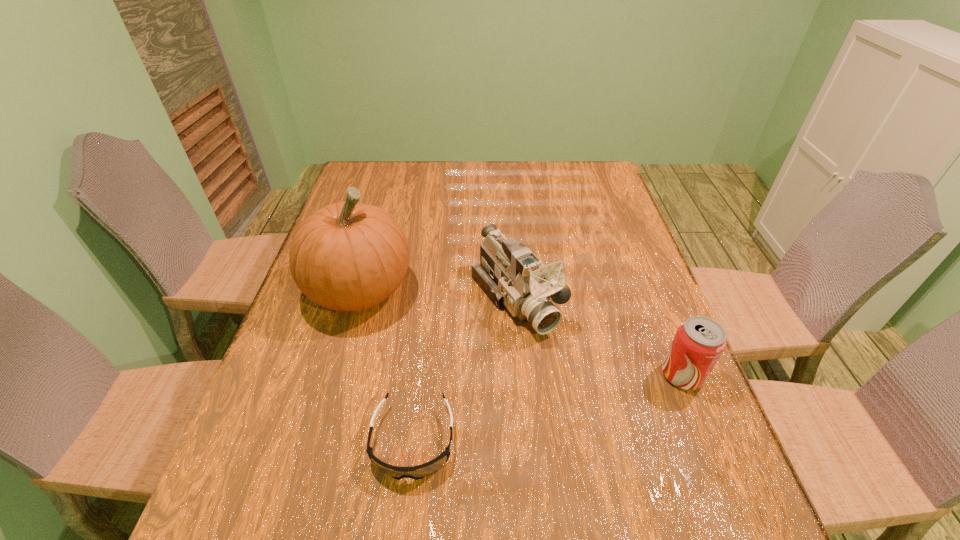
Where is `free region located 0.230m on the front-facing side of the third object from left to right`? This screenshot has width=960, height=540. free region located 0.230m on the front-facing side of the third object from left to right is located at coordinates (606, 418).

Locate an element on the screen. Image resolution: width=960 pixels, height=540 pixels. blank space located 0.120m on the stem of the tallest object is located at coordinates (443, 328).

Image resolution: width=960 pixels, height=540 pixels. Find the location of `vacant space located on the stem of the tallest object`. vacant space located on the stem of the tallest object is located at coordinates (486, 348).

Identify the location of free space located on the stem of the tallest object. (490, 350).

You are a GUI agent. You are given a task and a screenshot of the screen. Output one action in this format:
    pyautogui.click(x=<x>, y=<y>)
    Task: Click on the object positioned at the near edge
    This screenshot has width=960, height=540.
    Given the screenshot: What is the action you would take?
    pyautogui.click(x=421, y=471)

Image resolution: width=960 pixels, height=540 pixels. I want to click on object present at the left edge, so click(x=347, y=256).

This screenshot has width=960, height=540. In order to click on object positioned at the right edge in this screenshot , I will do `click(699, 341)`.

Image resolution: width=960 pixels, height=540 pixels. Identify the location of vacant space at the far edge of the desktop. (398, 176).

Where is `vacant region at the left edge of the desktop`? The width and height of the screenshot is (960, 540). vacant region at the left edge of the desktop is located at coordinates click(340, 328).

Identify the location of vacant space at the right edge. This screenshot has height=540, width=960. (622, 231).